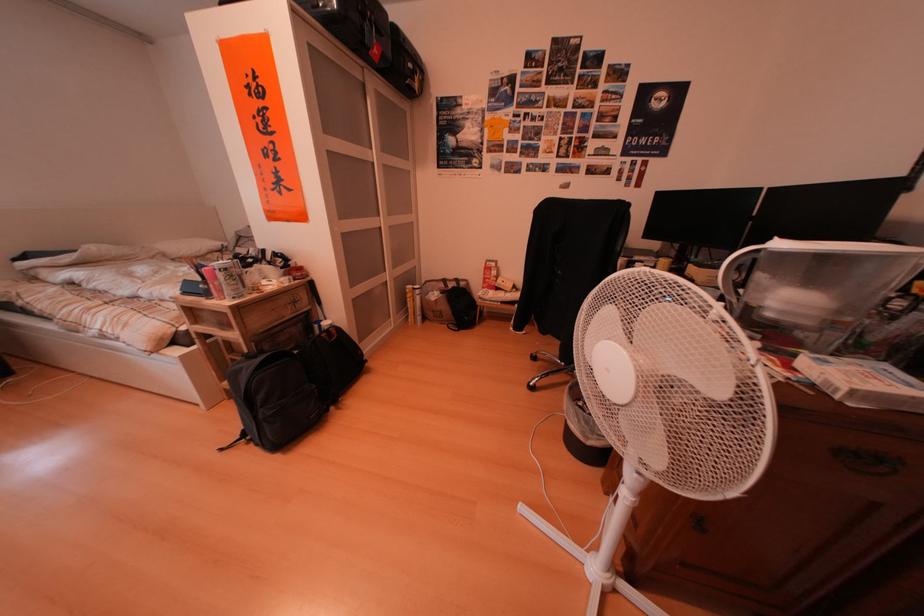
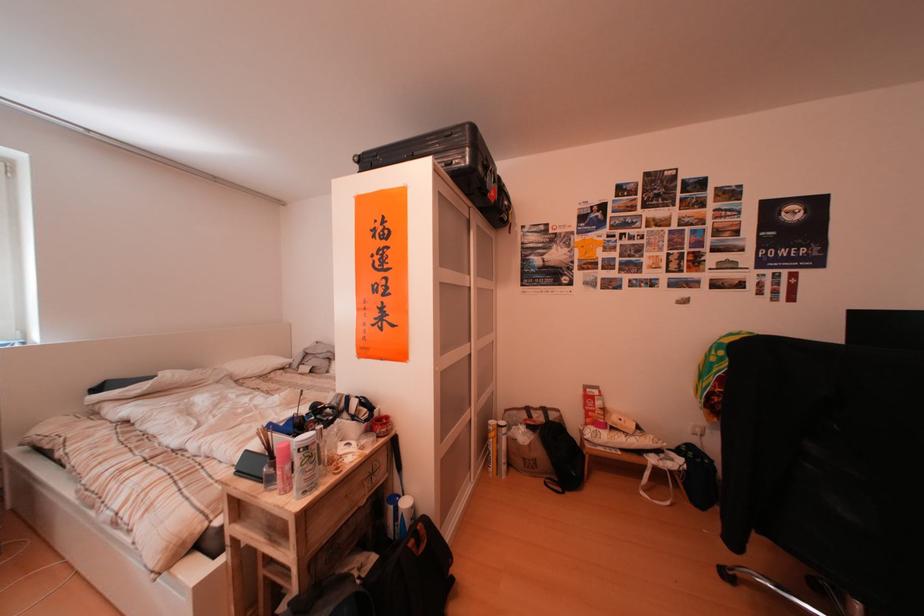
Locate, in the second image, the point that corresponds to [420,301] in the first image.

(505, 440)